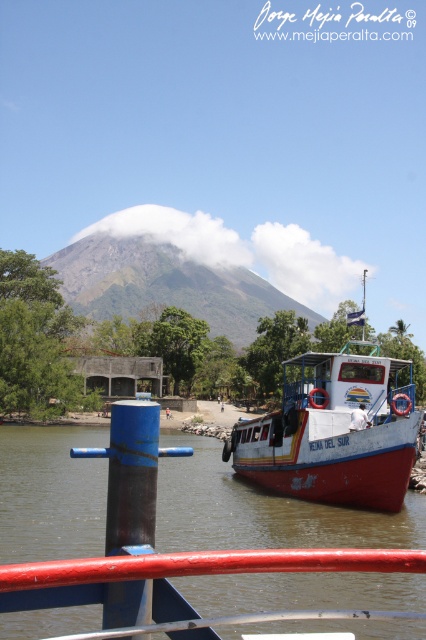
You are a tourist standing on the pier next to the white matte boat at center and the red painted metal railing at lower center. You want to take a photo of the volcano in the background. Which object should you stand closer to so that the volcano appears larger in your photo?

To make the volcano appear larger in your photo, you should stand closer to the white matte boat at center because it is much taller than the red painted metal railing at lower center, allowing you to position yourself at a lower angle towards the volcano.

You are a tourist standing on the pier and want to board the white matte boat at center. Which direction should you walk relative to the blue metallic pole at center to reach the boat?

The white matte boat at center is positioned on the right side of the blue metallic pole at center, so you should walk to the right of the blue metallic pole at center to reach the boat.